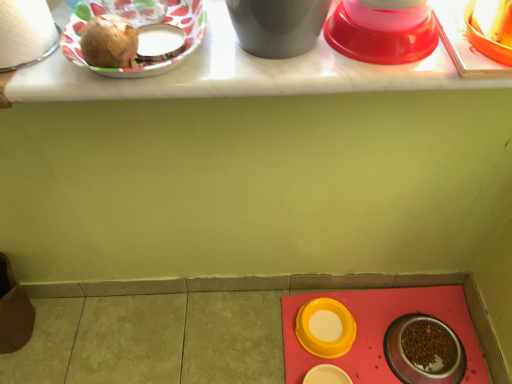
Question: Is white matte toilet paper at upper left completely or partially outside of matte white table at upper center?

Choices:
 (A) no
 (B) yes

Answer: (B)

Question: Is white matte toilet paper at upper left directly adjacent to matte white table at upper center?

Choices:
 (A) yes
 (B) no

Answer: (B)

Question: Is white matte toilet paper at upper left further to camera compared to matte white table at upper center?

Choices:
 (A) yes
 (B) no

Answer: (B)

Question: Is white matte toilet paper at upper left to the left of matte white table at upper center from the viewer's perspective?

Choices:
 (A) no
 (B) yes

Answer: (B)

Question: Is white matte toilet paper at upper left closer to camera compared to matte white table at upper center?

Choices:
 (A) no
 (B) yes

Answer: (B)

Question: From the image's perspective, is shiny brown onion at upper left located above or below matte plastic plate at upper left, arranged as the sixth tableware when viewed from the right?

Choices:
 (A) above
 (B) below

Answer: (B)

Question: Is shiny brown onion at upper left bigger or smaller than matte plastic plate at upper left, which is the 6th tableware in back-to-front order?

Choices:
 (A) small
 (B) big

Answer: (A)

Question: Considering their positions, is shiny brown onion at upper left located in front of or behind matte plastic plate at upper left, which is the fifth tableware from bottom to top?

Choices:
 (A) front
 (B) behind

Answer: (A)

Question: Based on their positions, is shiny brown onion at upper left located to the left or right of matte plastic plate at upper left, placed as the 1th tableware when sorted from front to back?

Choices:
 (A) left
 (B) right

Answer: (A)

Question: Based on their sizes in the image, would you say white matte toilet paper at upper left is bigger or smaller than yellow plastic bowl at lower center, which is the fifth tableware in left-to-right order?

Choices:
 (A) big
 (B) small

Answer: (A)

Question: From the image's perspective, is white matte toilet paper at upper left above or below yellow plastic bowl at lower center, which is the 3th tableware in bottom-to-top order?

Choices:
 (A) below
 (B) above

Answer: (B)

Question: Would you say white matte toilet paper at upper left is to the left or to the right of yellow plastic bowl at lower center, the first tableware from the back, in the picture?

Choices:
 (A) right
 (B) left

Answer: (B)

Question: In terms of width, does white matte toilet paper at upper left look wider or thinner when compared to yellow plastic bowl at lower center, which is the 2th tableware from right to left?

Choices:
 (A) thin
 (B) wide

Answer: (A)

Question: From a real-world perspective, is white matte toilet paper at upper left physically located above or below metallic silver bowl at lower right, which is the second tableware from bottom to top?

Choices:
 (A) below
 (B) above

Answer: (B)

Question: Which is correct: white matte toilet paper at upper left is inside metallic silver bowl at lower right, the 3th tableware from the back, or outside of it?

Choices:
 (A) inside
 (B) outside

Answer: (B)